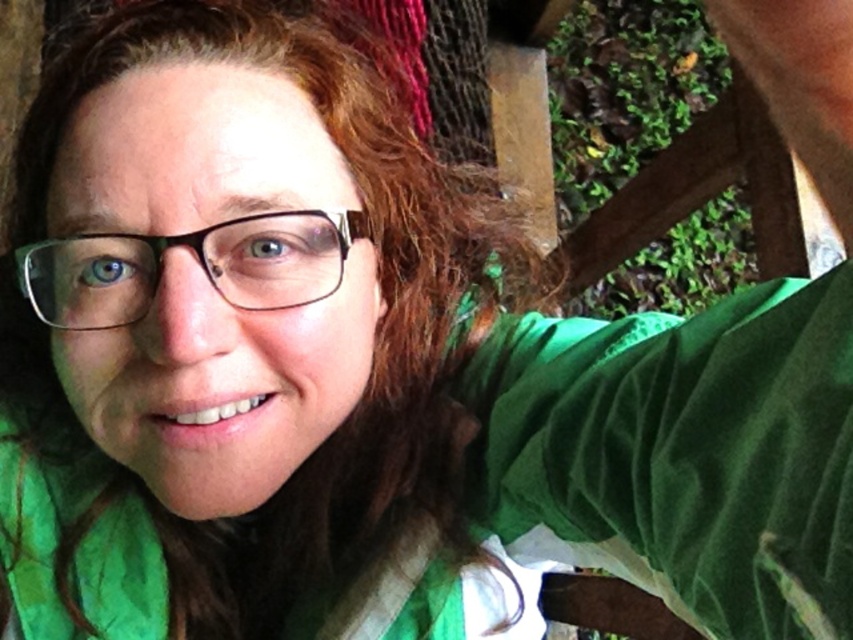
Does velvet green shirt at upper right have a greater height compared to clear plastic glasses at center?

Yes.

Describe the element at coordinates (686, 452) in the screenshot. I see `velvet green shirt at upper right` at that location.

Is point (695, 358) positioned in front of point (109, 268)?

Yes, it is in front of point (109, 268).

At what (x,y) coordinates should I click in order to perform the action: click on velvet green shirt at upper right. Please return your answer as a coordinate pair (x, y). Image resolution: width=853 pixels, height=640 pixels. Looking at the image, I should click on (686, 452).

Does brownhair at center have a larger size compared to clear plastic glasses at center?

Correct, brownhair at center is larger in size than clear plastic glasses at center.

Is brownhair at center to the left of clear plastic glasses at center from the viewer's perspective?

Incorrect, brownhair at center is not on the left side of clear plastic glasses at center.

Image resolution: width=853 pixels, height=640 pixels. What do you see at coordinates (265, 355) in the screenshot? I see `brownhair at center` at bounding box center [265, 355].

Locate an element on the screen. This screenshot has height=640, width=853. brownhair at center is located at coordinates (265, 355).

The height and width of the screenshot is (640, 853). Identify the location of brownhair at center. (265, 355).

Does brownhair at center have a smaller size compared to velvet green shirt at upper right?

Actually, brownhair at center might be larger than velvet green shirt at upper right.

Is point (42, 132) farther from viewer compared to point (590, 451)?

Yes, it is.

The image size is (853, 640). What are the coordinates of `brownhair at center` in the screenshot? It's located at (265, 355).